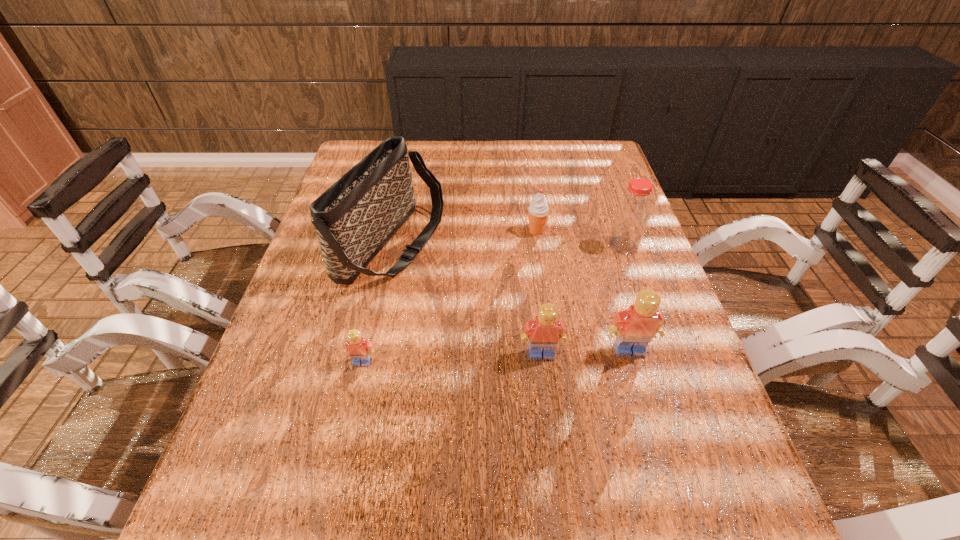
The width and height of the screenshot is (960, 540). What are the coordinates of `vacant space in between the icecream and the rightmost Lego` in the screenshot? It's located at (583, 291).

Where is `free point between the leftmost Lego and the icecream`? The image size is (960, 540). free point between the leftmost Lego and the icecream is located at coordinates (449, 296).

Where is `object that is the fourth closest to the bottle`? This screenshot has height=540, width=960. object that is the fourth closest to the bottle is located at coordinates (354, 219).

You are a GUI agent. You are given a task and a screenshot of the screen. Output one action in this format:
    pyautogui.click(x=<x>, y=<y>)
    Task: Click on the second closest object relative to the rightmost Lego
    This screenshot has height=540, width=960.
    Given the screenshot: What is the action you would take?
    pyautogui.click(x=632, y=214)

Choose which Lego is the second nearest neighbor to the leftmost Lego. Please provide its 2D coordinates. Your answer should be formatted as a tuple, i.e. [(x, y)], where the tuple contains the x and y coordinates of a point satisfying the conditions above.

[(634, 328)]

Locate which Lego is the closest to the leftmost Lego. Please provide its 2D coordinates. Your answer should be formatted as a tuple, i.e. [(x, y)], where the tuple contains the x and y coordinates of a point satisfying the conditions above.

[(546, 331)]

Locate an element on the screen. The width and height of the screenshot is (960, 540). free region that satisfies the following two spatial constraints: 1. on the front side of the icecream; 2. on the left side of the bottle is located at coordinates (539, 246).

Where is `free location that satisfies the following two spatial constraints: 1. on the front side of the handbag; 2. on the right side of the bottle`? The height and width of the screenshot is (540, 960). free location that satisfies the following two spatial constraints: 1. on the front side of the handbag; 2. on the right side of the bottle is located at coordinates (392, 246).